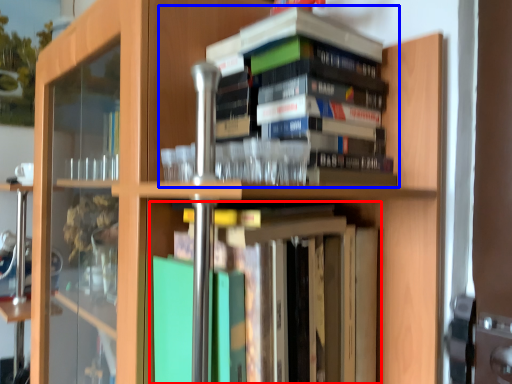
Question: Which object is further to the camera taking this photo, book (highlighted by a red box) or book (highlighted by a blue box)?

Choices:
 (A) book
 (B) book

Answer: (B)